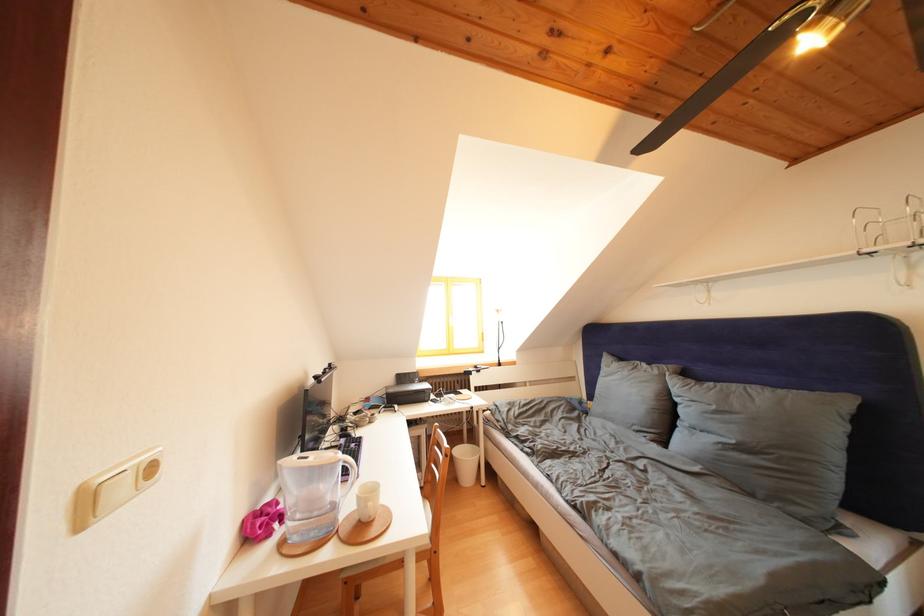
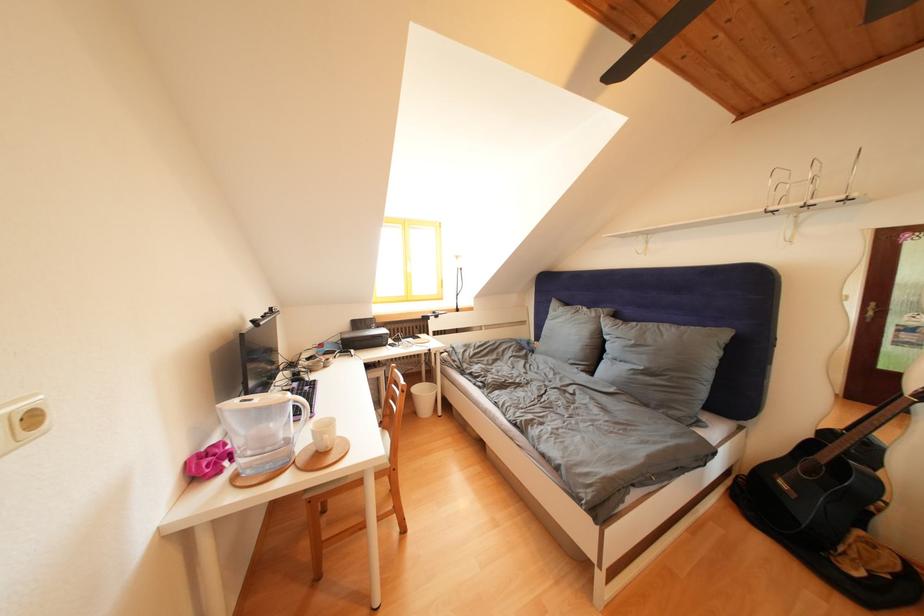
Where in the second image is the point corresponding to [629,363] from the first image?

(575, 310)